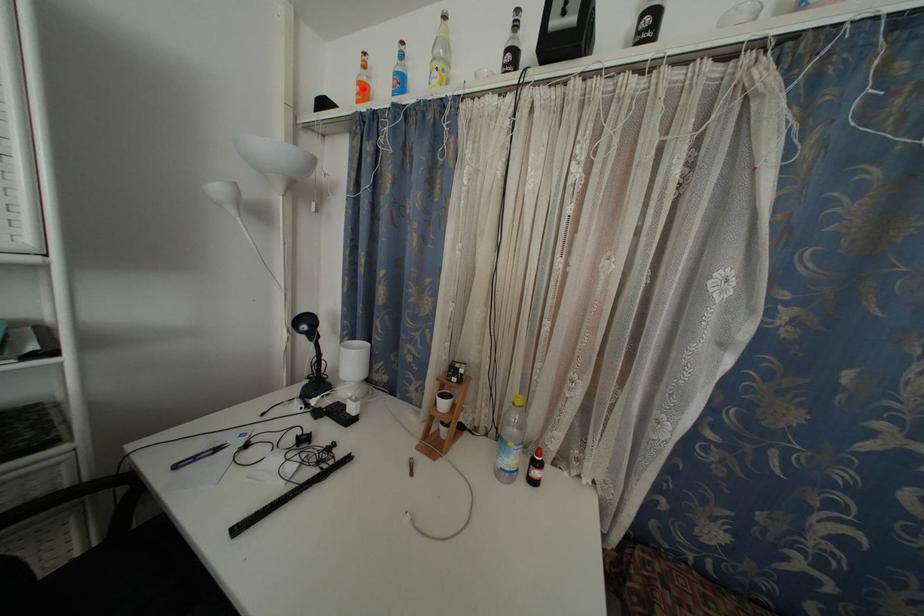
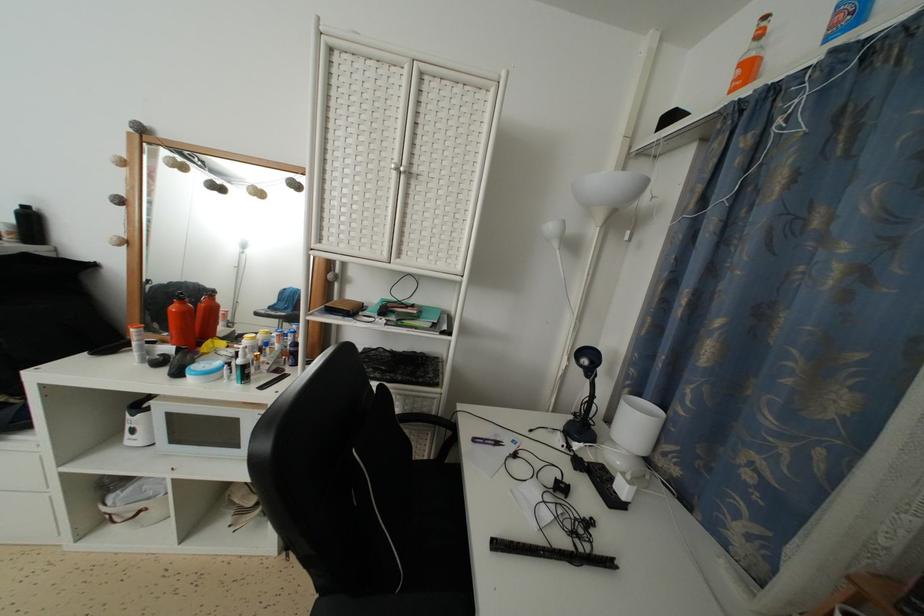
In the second image, find the point that corresponds to the highlighted location in the first image.

(746, 70)